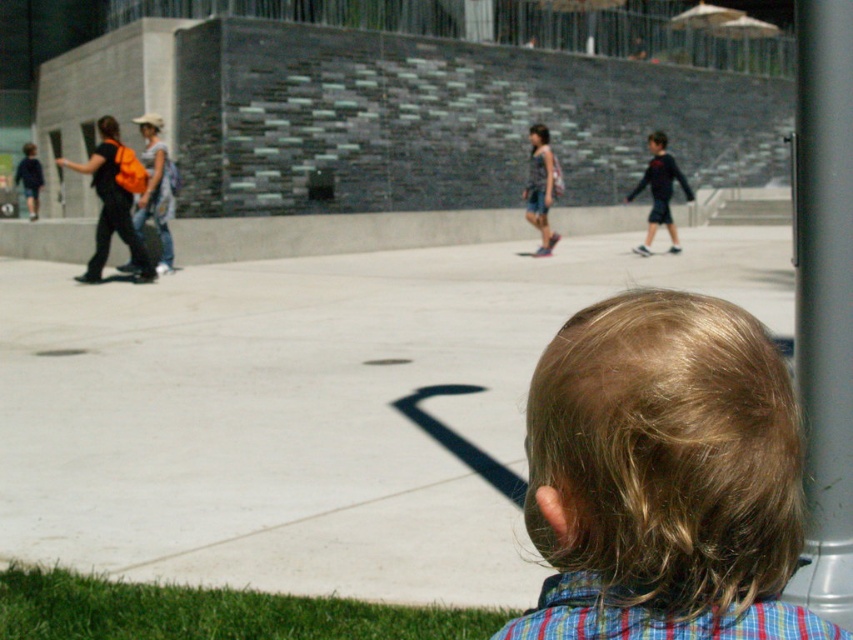
In order to click on gray concrete pavement at center in this screenshot , I will do `click(311, 410)`.

Consider the image. Does gray concrete pavement at center appear over denim shorts at center?

Incorrect, gray concrete pavement at center is not positioned above denim shorts at center.

You are a GUI agent. You are given a task and a screenshot of the screen. Output one action in this format:
    pyautogui.click(x=<x>, y=<y>)
    Task: Click on the gray concrete pavement at center
    Image resolution: width=853 pixels, height=640 pixels.
    Given the screenshot: What is the action you would take?
    pyautogui.click(x=311, y=410)

Locate an element on the screen. The height and width of the screenshot is (640, 853). gray concrete pavement at center is located at coordinates (311, 410).

Who is more forward, (752, 637) or (541, 132)?

Point (752, 637)

Locate an element on the screen. plaid cotton shirt at lower right is located at coordinates coord(653,618).

Who is taller, plaid cotton shirt at lower right or dark blue sweater at right?

dark blue sweater at right is taller.

Who is lower down, plaid cotton shirt at lower right or dark blue sweater at right?

Positioned lower is plaid cotton shirt at lower right.

Does point (764, 611) come behind point (669, 236)?

That is False.

Where is `plaid cotton shirt at lower right`? This screenshot has width=853, height=640. plaid cotton shirt at lower right is located at coordinates (653, 618).